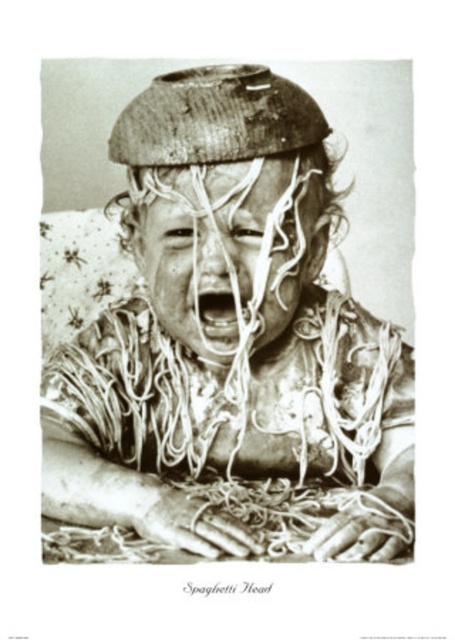
You are a photographer who wants to take a closeup shot of the smooth white noodles at center without the wooden bowl at upper center blocking the view. Is it possible to do so without moving any objects?

The wooden bowl at upper center is taller than smooth white noodles at center, so it will block the view of the smooth white noodles at center. Therefore, it is not possible to take a closeup shot without moving the wooden bowl at upper center.

You are a photographer who wants to capture a similar scene. You have a wooden bowl at upper center and smooth white noodles at center. Which object is wider?

The wooden bowl at upper center is wider than the smooth white noodles at center.